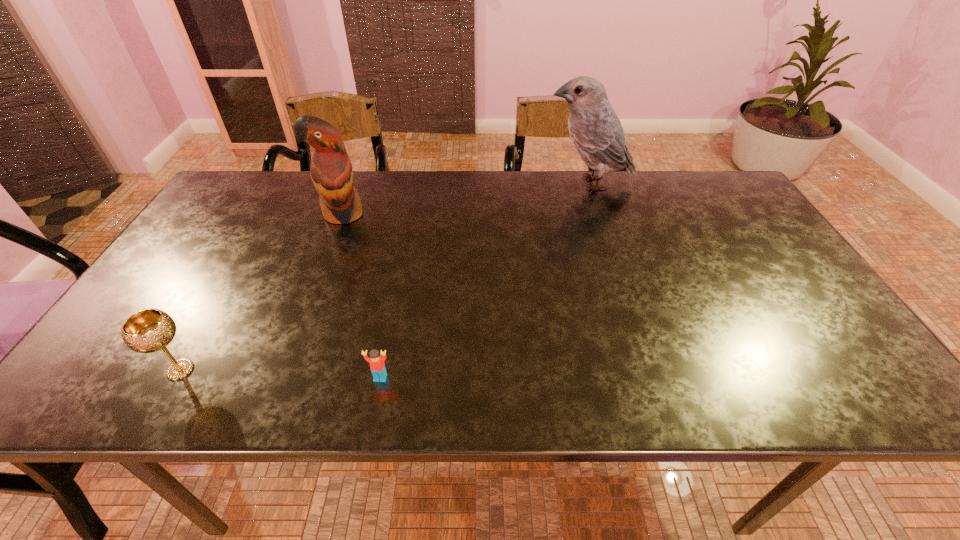
At what (x,y) coordinates should I click in order to perform the action: click on free spot between the shortest object and the nearer parrot. Please return your answer as a coordinate pair (x, y). This screenshot has width=960, height=540. Looking at the image, I should click on (362, 296).

Find the location of a particular element. unoccupied area between the third nearest object and the leftmost object is located at coordinates (261, 292).

Locate which object ranks second in proximity to the third nearest object. Please provide its 2D coordinates. Your answer should be formatted as a tuple, i.e. [(x, y)], where the tuple contains the x and y coordinates of a point satisfying the conditions above.

[(377, 366)]

Locate which object is the third closest to the shortest object. Please provide its 2D coordinates. Your answer should be formatted as a tuple, i.e. [(x, y)], where the tuple contains the x and y coordinates of a point satisfying the conditions above.

[(596, 132)]

You are a GUI agent. You are given a task and a screenshot of the screen. Output one action in this format:
    pyautogui.click(x=<x>, y=<y>)
    Task: Click on the vacant space that satisfies the following two spatial constraints: 1. on the front-facing side of the farther parrot; 2. on the face of the third object from right to left
    
    Given the screenshot: What is the action you would take?
    [x=599, y=214]

Where is `blank area in the image that satisfies the following two spatial constraints: 1. on the front-facing side of the rightmost object; 2. on the face of the left parrot`? This screenshot has width=960, height=540. blank area in the image that satisfies the following two spatial constraints: 1. on the front-facing side of the rightmost object; 2. on the face of the left parrot is located at coordinates (599, 214).

Find the location of `blank area in the image that satisfies the following two spatial constraints: 1. on the front-facing side of the farther parrot; 2. on the face of the third object from left to right`. blank area in the image that satisfies the following two spatial constraints: 1. on the front-facing side of the farther parrot; 2. on the face of the third object from left to right is located at coordinates (652, 378).

Locate an element on the screen. Image resolution: width=960 pixels, height=540 pixels. vacant point that satisfies the following two spatial constraints: 1. on the front-facing side of the farthest object; 2. on the face of the third nearest object is located at coordinates (599, 214).